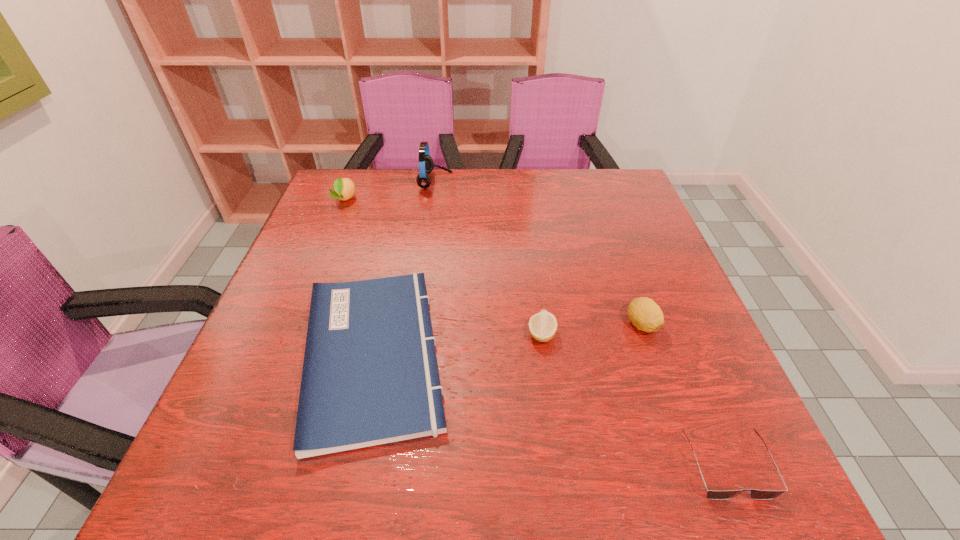
The width and height of the screenshot is (960, 540). Identify the location of vacant space positioned on the right of the paperback book. (623, 354).

Identify the location of free space located on the right of the fourth object from left to right. The image size is (960, 540). (667, 334).

You are a GUI agent. You are given a task and a screenshot of the screen. Output one action in this format:
    pyautogui.click(x=<x>, y=<y>)
    Task: Click on the headset situated at the far edge
    The height and width of the screenshot is (540, 960).
    Given the screenshot: What is the action you would take?
    pyautogui.click(x=426, y=164)

This screenshot has width=960, height=540. I want to click on lemon at the far edge, so click(344, 188).

Locate an element on the screen. The width and height of the screenshot is (960, 540). paperback book at the near edge is located at coordinates (370, 377).

In order to click on sunglasses positioned at the near edge in this screenshot , I will do `click(755, 494)`.

I want to click on lemon located in the left edge section of the desktop, so click(x=344, y=188).

Where is `paperback book at the left edge`? This screenshot has height=540, width=960. paperback book at the left edge is located at coordinates (370, 377).

Locate an element on the screen. lemon located at the right edge is located at coordinates [644, 313].

Image resolution: width=960 pixels, height=540 pixels. What are the coordinates of `sunglasses that is at the right edge` in the screenshot? It's located at (755, 494).